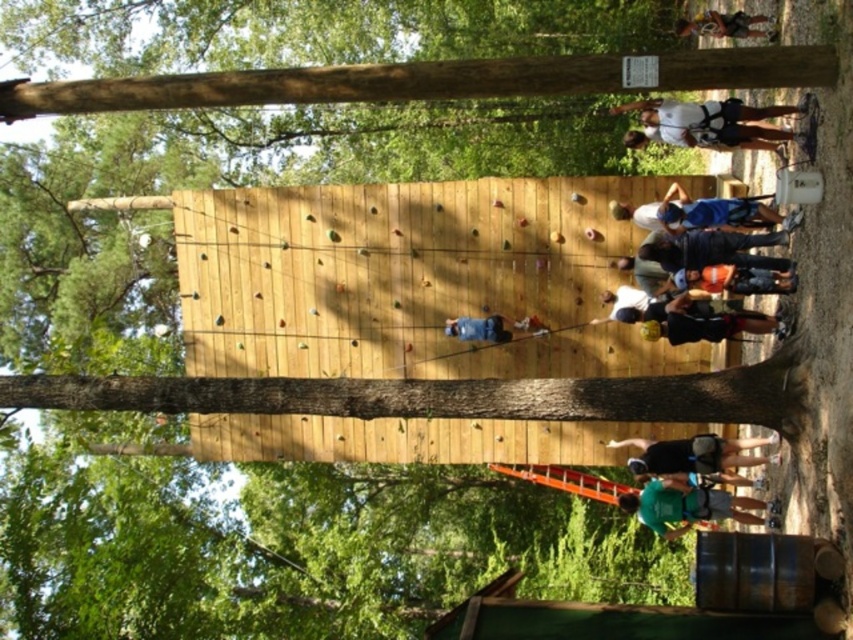
Is green fabric shirt at lower center positioned in front of blue fabric shirt at center?

No.

Is point (746, 502) positioned in front of point (648, 205)?

That is False.

Locate an element on the screen. green fabric shirt at lower center is located at coordinates (688, 502).

Is blue fabric shirt at center positioned in front of black fabric backpack at lower center?

That is True.

Does blue fabric shirt at center appear over black fabric backpack at lower center?

Yes, blue fabric shirt at center is above black fabric backpack at lower center.

Who is more distant from viewer, [677,221] or [636,467]?

Positioned behind is point [636,467].

Image resolution: width=853 pixels, height=640 pixels. Identify the location of blue fabric shirt at center. (701, 212).

Does green fabric shirt at lower center lie behind blue denim jeans at center?

No, green fabric shirt at lower center is closer to the viewer.

This screenshot has height=640, width=853. I want to click on green fabric shirt at lower center, so click(688, 502).

Who is more distant from viewer, (740, 499) or (502, 323)?

Point (502, 323)

The height and width of the screenshot is (640, 853). I want to click on green fabric shirt at lower center, so click(x=688, y=502).